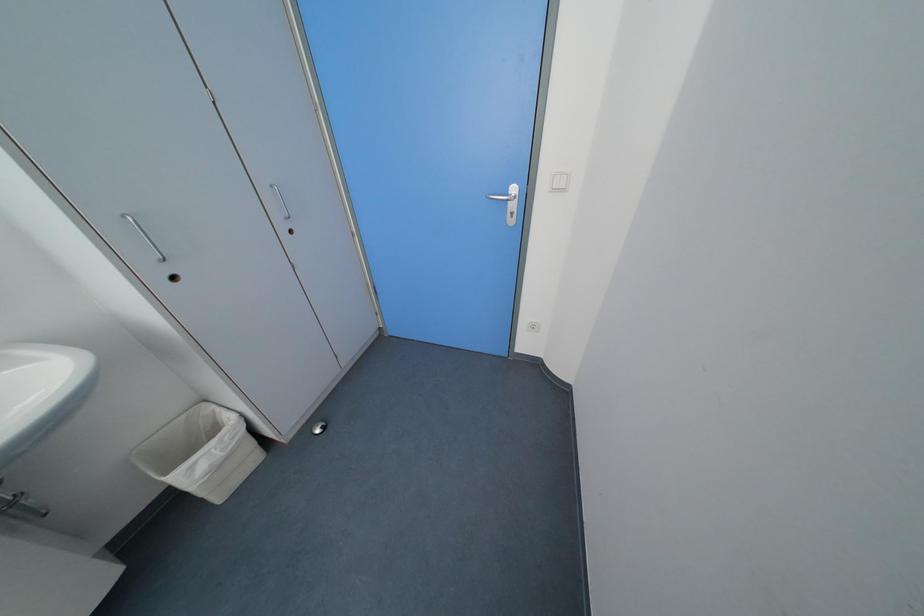
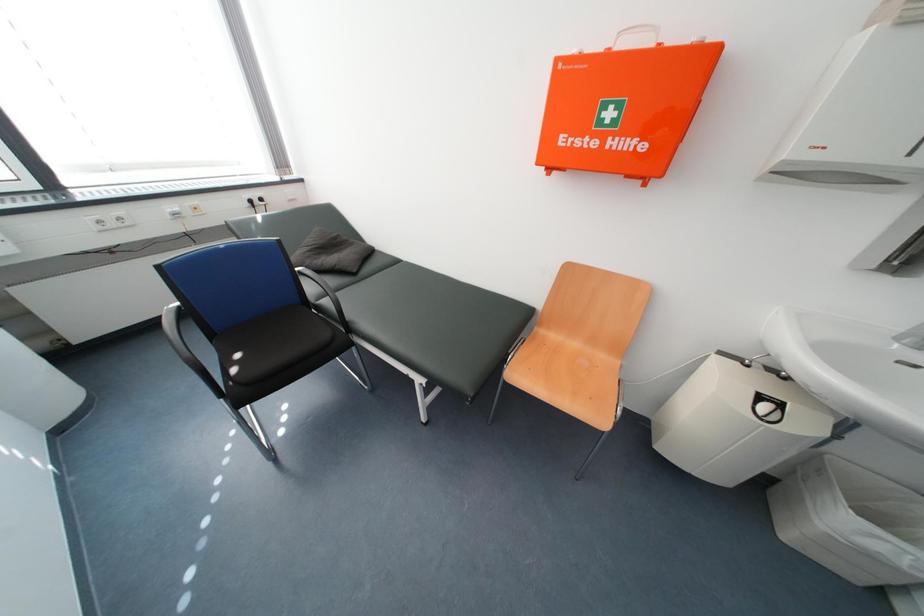
How did the camera likely rotate?

The camera's rotation is toward left-down.